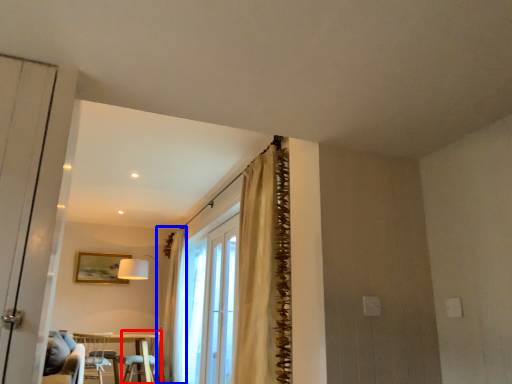
Question: Which of the following is the closest to the observer, armchair (highlighted by a red box) or curtain (highlighted by a blue box)?

Choices:
 (A) armchair
 (B) curtain

Answer: (A)